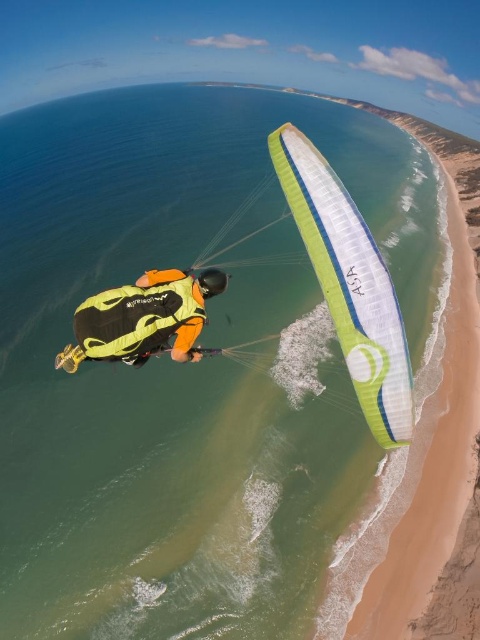
Question: Is green/white fabric parachute at center in front of yellow-green fabric parachute at center?

Choices:
 (A) yes
 (B) no

Answer: (B)

Question: Can you confirm if green/white fabric parachute at center is thinner than yellow-green fabric parachute at center?

Choices:
 (A) no
 (B) yes

Answer: (A)

Question: Is green/white fabric parachute at center closer to camera compared to yellow-green fabric parachute at center?

Choices:
 (A) no
 (B) yes

Answer: (A)

Question: Which point is closer to the camera?

Choices:
 (A) (368, 396)
 (B) (175, 333)

Answer: (B)

Question: Which of the following is the closest to the observer?

Choices:
 (A) green/white fabric parachute at center
 (B) yellow-green fabric parachute at center

Answer: (B)

Question: Which of the following is the farthest from the observer?

Choices:
 (A) yellow-green fabric parachute at center
 (B) green/white fabric parachute at center

Answer: (B)